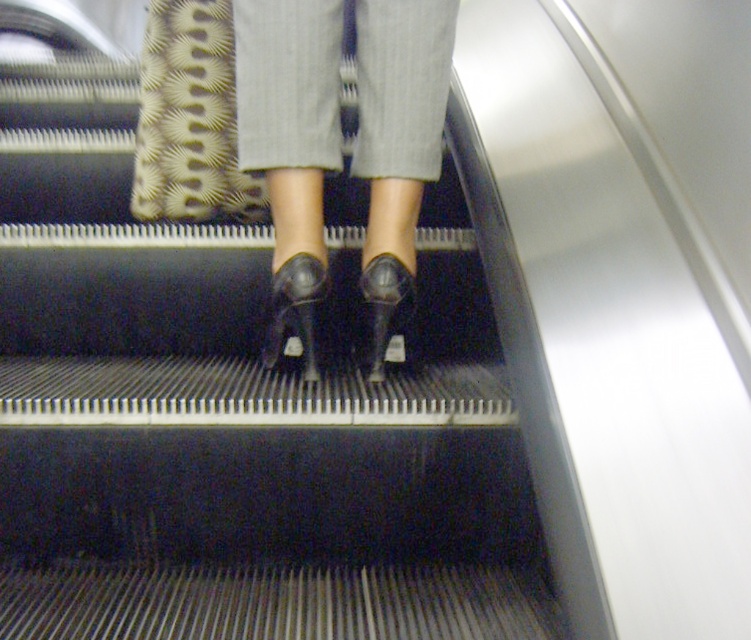
Question: Is shiny black high-heeled shoe at center in front of shiny black shoe at center?

Choices:
 (A) no
 (B) yes

Answer: (B)

Question: Considering the relative positions of black leather high heels at center and shiny black shoe at center in the image provided, where is black leather high heels at center located with respect to shiny black shoe at center?

Choices:
 (A) left
 (B) right

Answer: (A)

Question: Is shiny black high-heeled shoe at center further to the viewer compared to shiny black shoe at center?

Choices:
 (A) yes
 (B) no

Answer: (B)

Question: Which point is farther to the camera?

Choices:
 (A) black leather high heels at center
 (B) shiny black high-heeled shoe at center
 (C) shiny black shoe at center

Answer: (C)

Question: Which point is closer to the camera?

Choices:
 (A) black leather high heels at center
 (B) shiny black high-heeled shoe at center
 (C) shiny black shoe at center

Answer: (B)

Question: Which is nearer to the shiny black shoe at center?

Choices:
 (A) shiny black high-heeled shoe at center
 (B) black leather high heels at center

Answer: (A)